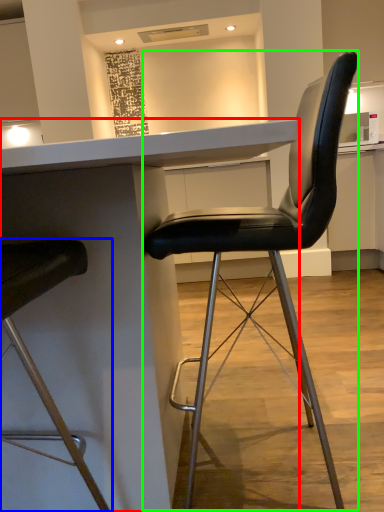
Question: Based on their relative distances, which object is nearer to table (highlighted by a red box)? Choose from chair (highlighted by a blue box) and chair (highlighted by a green box).

Choices:
 (A) chair
 (B) chair

Answer: (A)